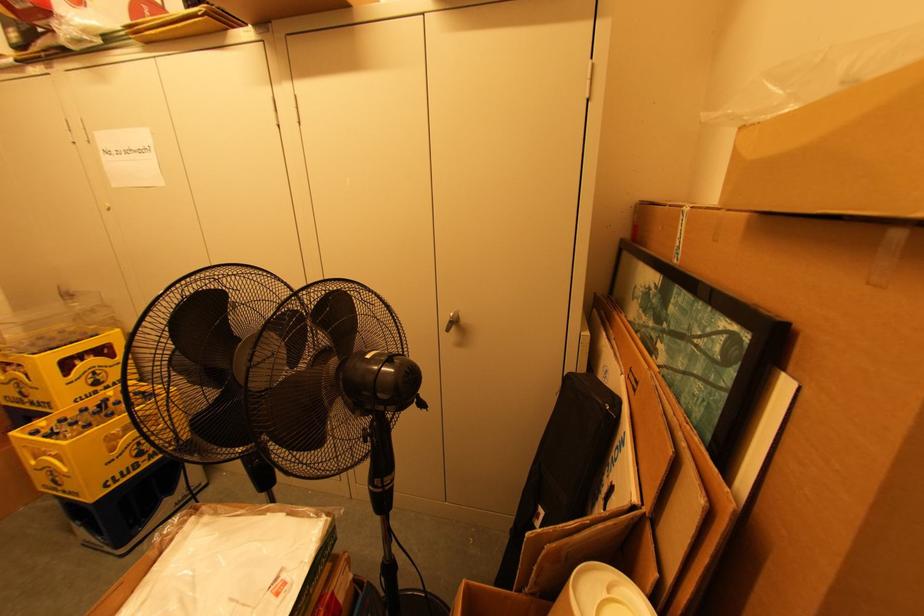
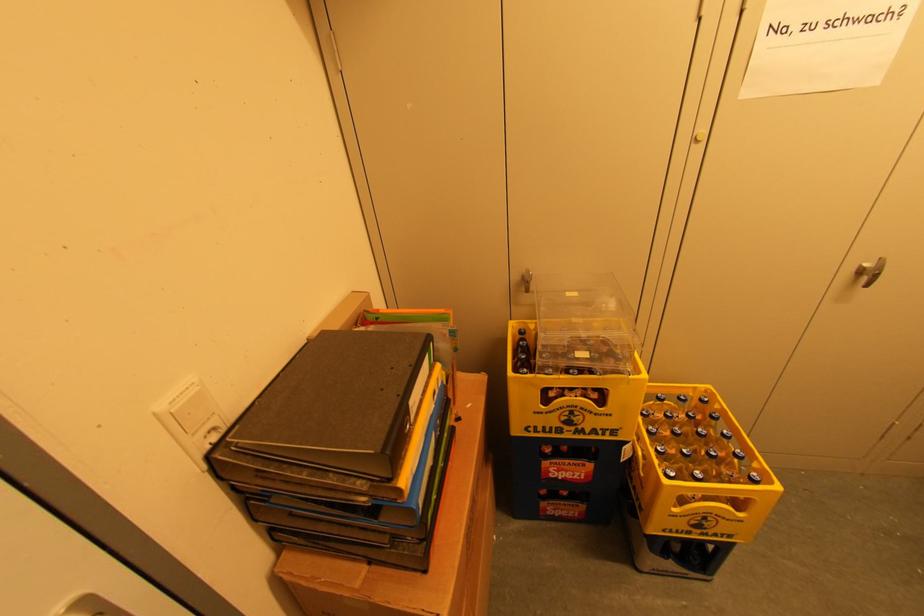
Question: In a continuous first-person perspective shot, in which direction is the camera moving?

Choices:
 (A) Left
 (B) Right
 (C) Forward
 (D) Backward

Answer: (A)